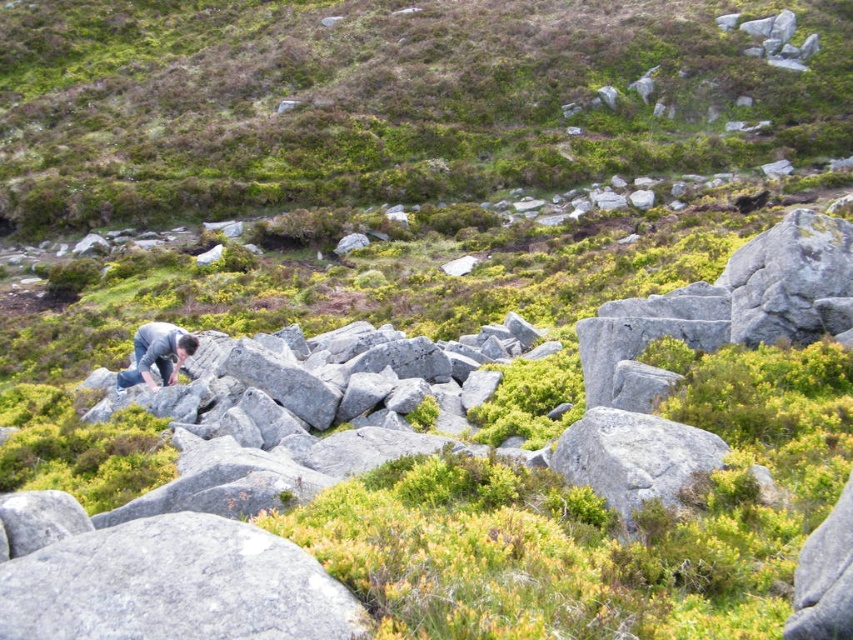
Consider the image. Between gray rough boulder at center-right and dark gray fabric at lower left, which one is positioned lower?

gray rough boulder at center-right

Between gray rough boulder at center-right and dark gray fabric at lower left, which one is positioned higher?

dark gray fabric at lower left

Identify the location of gray rough boulder at center-right. (634, 458).

Can you confirm if gray rough boulder at lower left is bigger than dark gray fabric at lower left?

Actually, gray rough boulder at lower left might be smaller than dark gray fabric at lower left.

Is point (171, 584) positioned behind point (175, 378)?

No, (171, 584) is in front of (175, 378).

This screenshot has width=853, height=640. Find the location of `gray rough boulder at lower left`. gray rough boulder at lower left is located at coordinates point(173,586).

Between gray rough boulder at lower left and gray rough boulder at center-right, which one appears on the left side from the viewer's perspective?

From the viewer's perspective, gray rough boulder at lower left appears more on the left side.

The width and height of the screenshot is (853, 640). What do you see at coordinates (173, 586) in the screenshot?
I see `gray rough boulder at lower left` at bounding box center [173, 586].

Does point (161, 596) lie behind point (636, 490)?

That is False.

Find the location of a particular element. gray rough boulder at lower left is located at coordinates (173, 586).